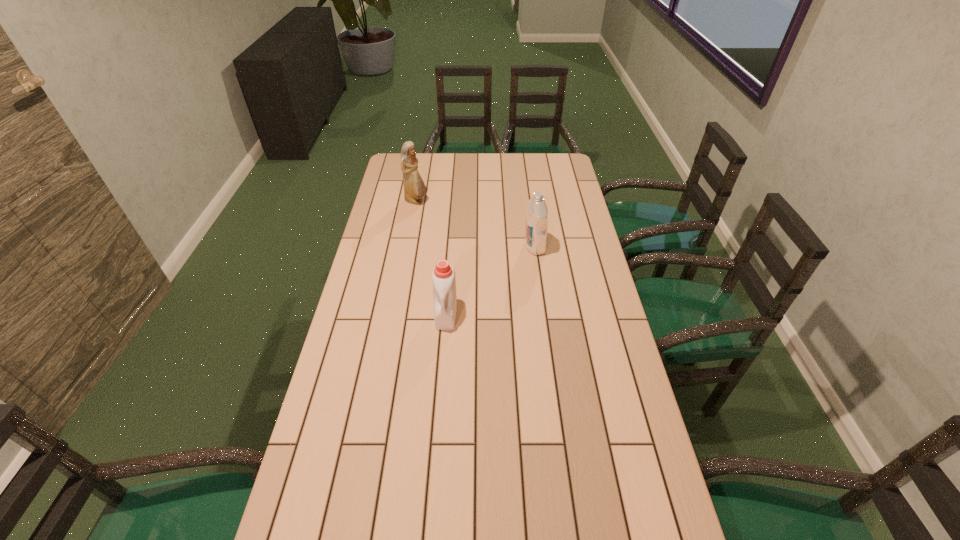
In order to click on free spot that satisfies the following two spatial constraints: 1. on the front-facing side of the farthest object; 2. on the left side of the rightmost object in this screenshot , I will do `click(408, 247)`.

This screenshot has width=960, height=540. I want to click on vacant space that satisfies the following two spatial constraints: 1. on the front-facing side of the farthest object; 2. on the back side of the second farthest object, so click(x=408, y=247).

At what (x,y) coordinates should I click in order to perform the action: click on free location that satisfies the following two spatial constraints: 1. on the front-facing side of the second farthest object; 2. on the left side of the farthest object. Please return your answer as a coordinate pair (x, y). The width and height of the screenshot is (960, 540). Looking at the image, I should click on (408, 247).